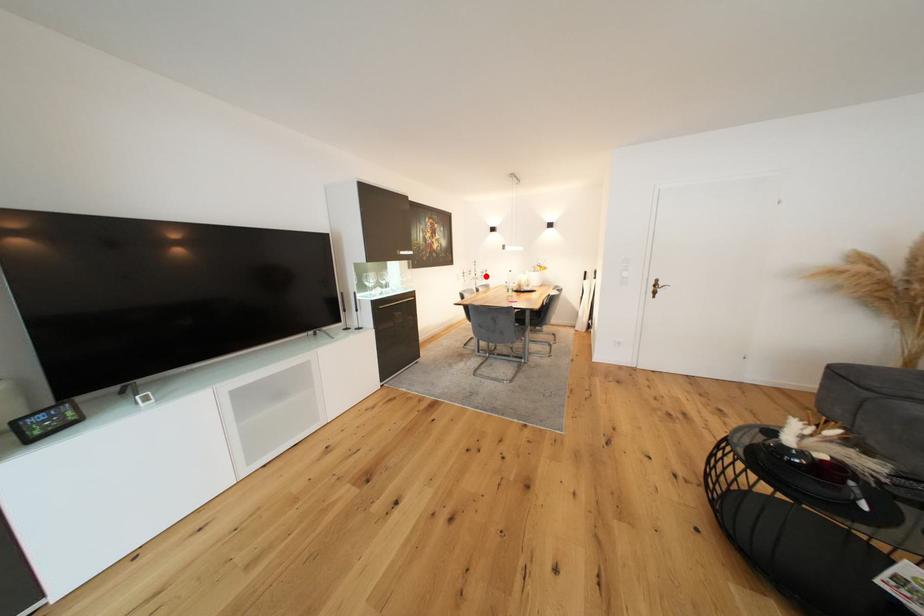
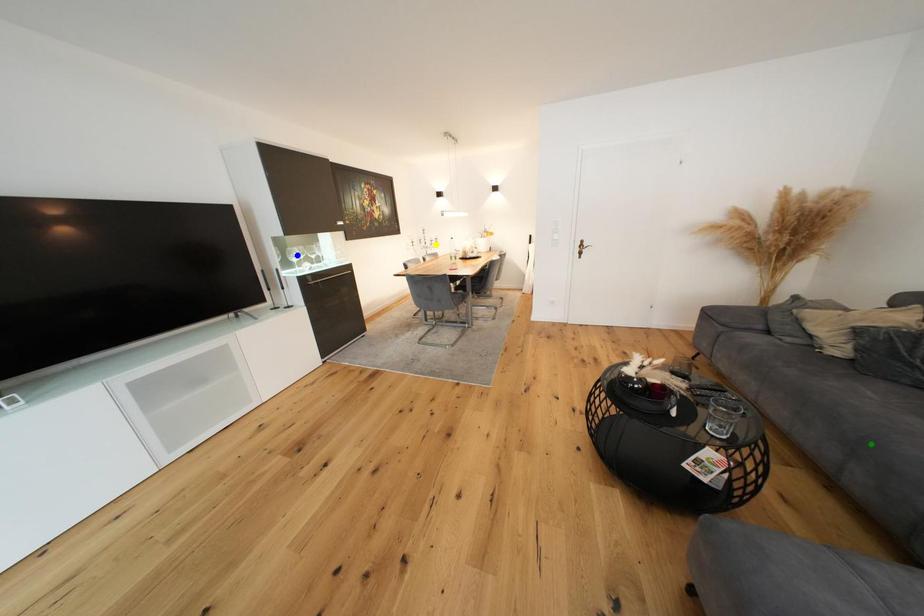
Question: I am providing you with two images of the same scene from different viewpoints. A red point is marked on the first image. You are given multiple points on the second image. Which mark in image 2 goes with the point in image 1?

Choices:
 (A) blue point
 (B) green point
 (C) yellow point

Answer: (C)